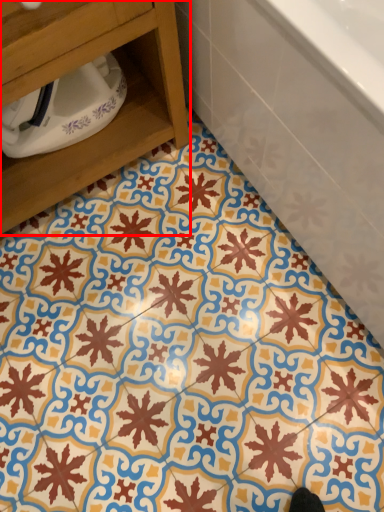
Question: From the image's perspective, what is the correct spatial positioning of furniture (annotated by the red box) in reference to bathtub?

Choices:
 (A) below
 (B) above

Answer: (A)